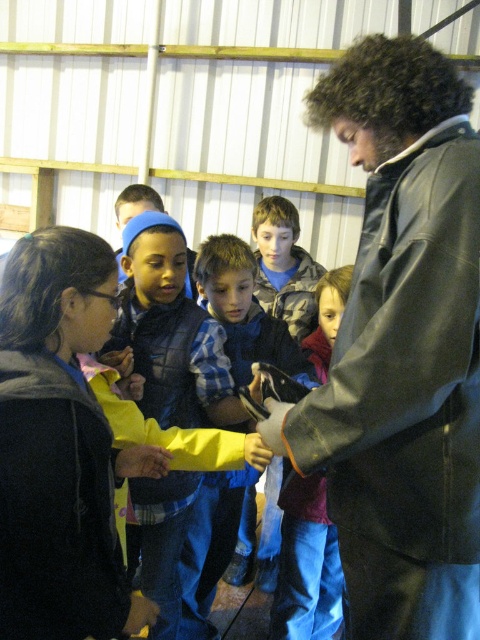
Question: Which object is positioned closest to the blue plaid shirt at center?

Choices:
 (A) black leather jacket at center
 (B) black matte jacket at left
 (C) maroon fleece jacket at center
 (D) camouflage jacket at center

Answer: (C)

Question: Which point is closer to the camera?

Choices:
 (A) blue plaid shirt at center
 (B) maroon fleece jacket at center
 (C) black leather jacket at center

Answer: (C)

Question: Does black matte jacket at left have a smaller size compared to blue plaid shirt at center?

Choices:
 (A) no
 (B) yes

Answer: (B)

Question: Can you confirm if black leather jacket at center is thinner than maroon fleece jacket at center?

Choices:
 (A) yes
 (B) no

Answer: (B)

Question: In this image, where is yellow fabric jacket at center located relative to camouflage jacket at center?

Choices:
 (A) left
 (B) right

Answer: (A)

Question: Which object is farther from the camera taking this photo?

Choices:
 (A) yellow fabric jacket at center
 (B) camouflage jacket at center
 (C) black matte jacket at left

Answer: (B)